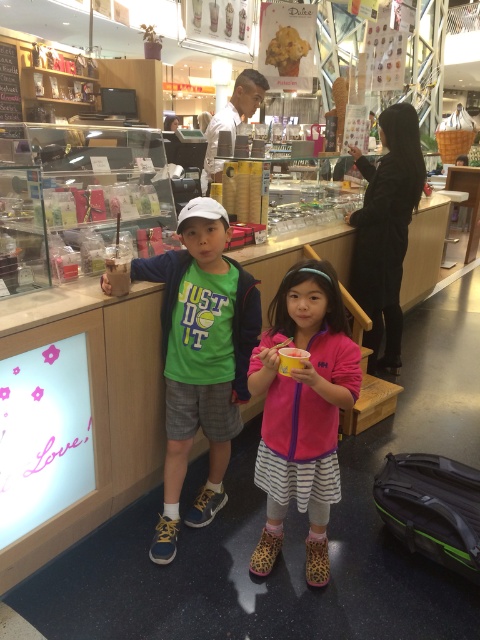
Can you confirm if pink fleece jacket at center is positioned to the right of metallic gold frame at upper left?

Yes, pink fleece jacket at center is to the right of metallic gold frame at upper left.

Is pink fleece jacket at center taller than metallic gold frame at upper left?

Yes, pink fleece jacket at center is taller than metallic gold frame at upper left.

Is point (291, 337) more distant than point (14, 58)?

No, (291, 337) is closer to viewer.

Find the location of a particular element. pink fleece jacket at center is located at coordinates (302, 410).

Between green fabric shirt at center and pink fleece jacket at center, which one appears on the right side from the viewer's perspective?

pink fleece jacket at center

Is green fabric shirt at center behind pink fleece jacket at center?

Yes.

Between point (177, 477) and point (316, 365), which one is positioned behind?

Positioned behind is point (177, 477).

Locate an element on the screen. This screenshot has height=640, width=480. green fabric shirt at center is located at coordinates (201, 356).

Can you confirm if green fabric shirt at center is positioned to the left of metallic gold frame at upper left?

In fact, green fabric shirt at center is to the right of metallic gold frame at upper left.

Between point (233, 381) and point (12, 74), which one is positioned behind?

Point (12, 74)

Locate an element on the screen. This screenshot has width=480, height=640. green fabric shirt at center is located at coordinates (201, 356).